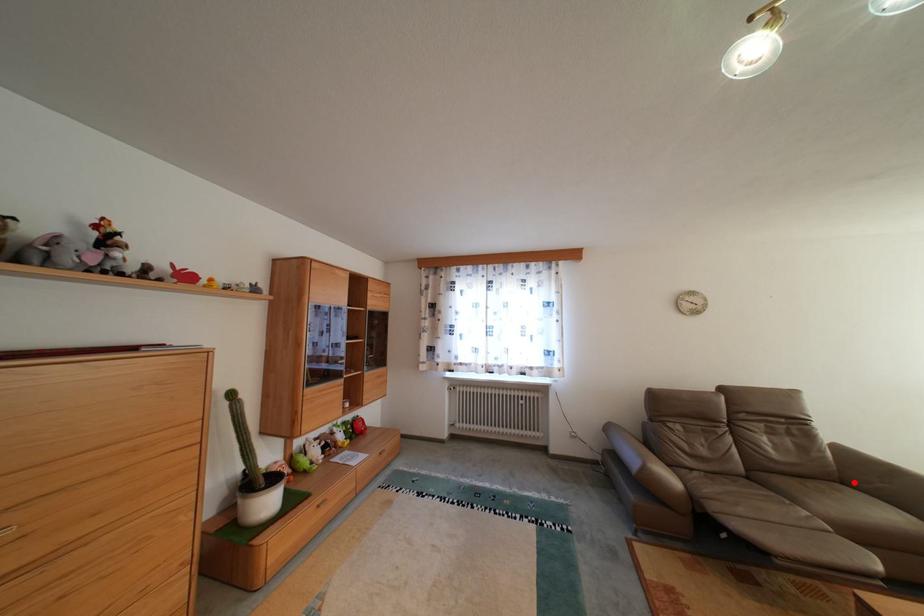
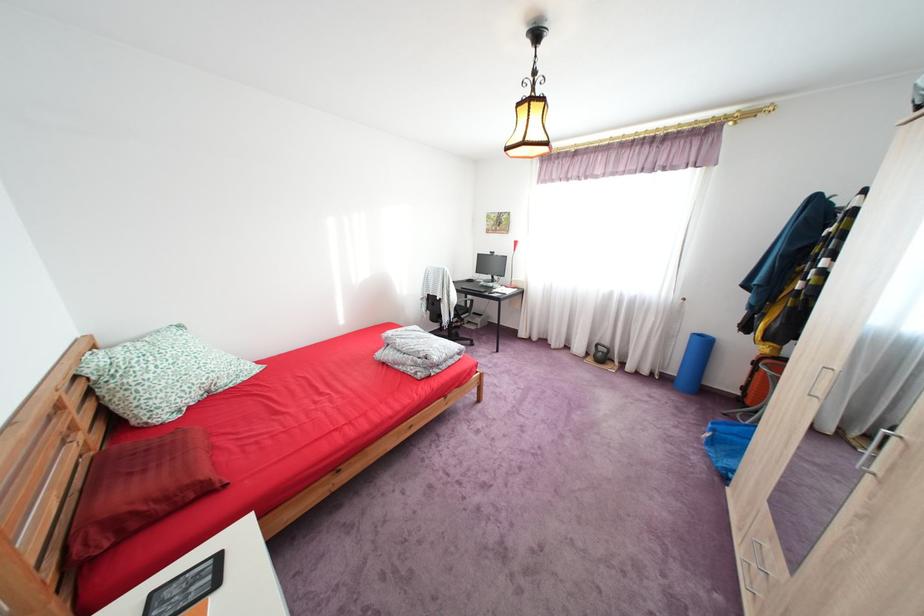
Question: I am providing you with two images of the same scene from different viewpoints. A red point is marked on the first image. Can you still see the location of the red point in image 2?

Choices:
 (A) Yes
 (B) No

Answer: (B)